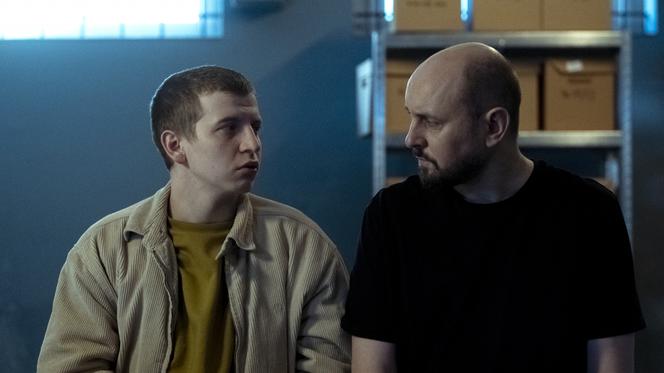
You are a GUI agent. You are given a task and a screenshot of the screen. Output one action in this format:
    pyautogui.click(x=<x>, y=<y>)
    Task: Click on the wall
    The height and width of the screenshot is (373, 664).
    Given the screenshot: What is the action you would take?
    pyautogui.click(x=129, y=145)